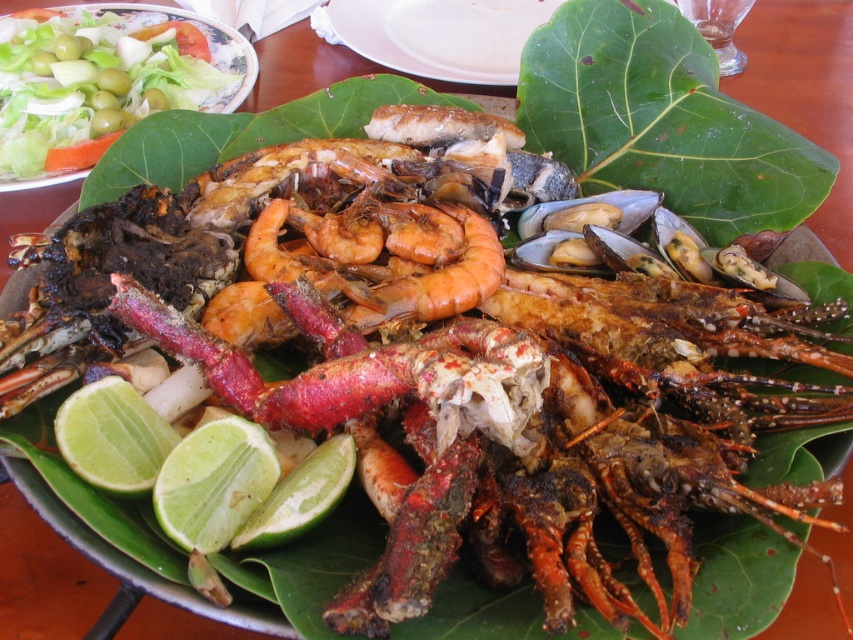
Question: Does green leafy at center come in front of green matte lemon at lower center?

Choices:
 (A) yes
 (B) no

Answer: (B)

Question: Considering the real-world distances, which object is farthest from the green matte lime at lower left?

Choices:
 (A) green matte lemon at lower center
 (B) green leafy at center
 (C) green leafy platter at center

Answer: (C)

Question: Considering the real-world distances, which object is closest to the green leafy salad at upper left?

Choices:
 (A) green matte lime at lower left
 (B) green matte lemon at lower left
 (C) green leafy platter at center
 (D) green matte lemon at lower center

Answer: (C)

Question: Is green leafy salad at upper left behind green matte lemon at lower left?

Choices:
 (A) yes
 (B) no

Answer: (A)

Question: Is green leafy at center in front of green matte lime at lower left?

Choices:
 (A) no
 (B) yes

Answer: (A)

Question: Which point appears closest to the camera in this image?

Choices:
 (A) (434, 24)
 (B) (718, 116)

Answer: (B)